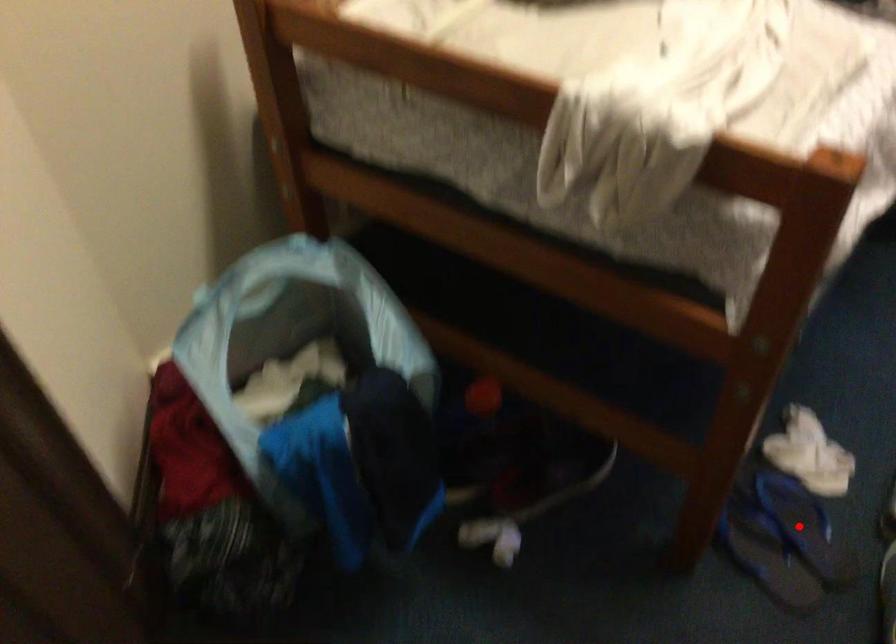
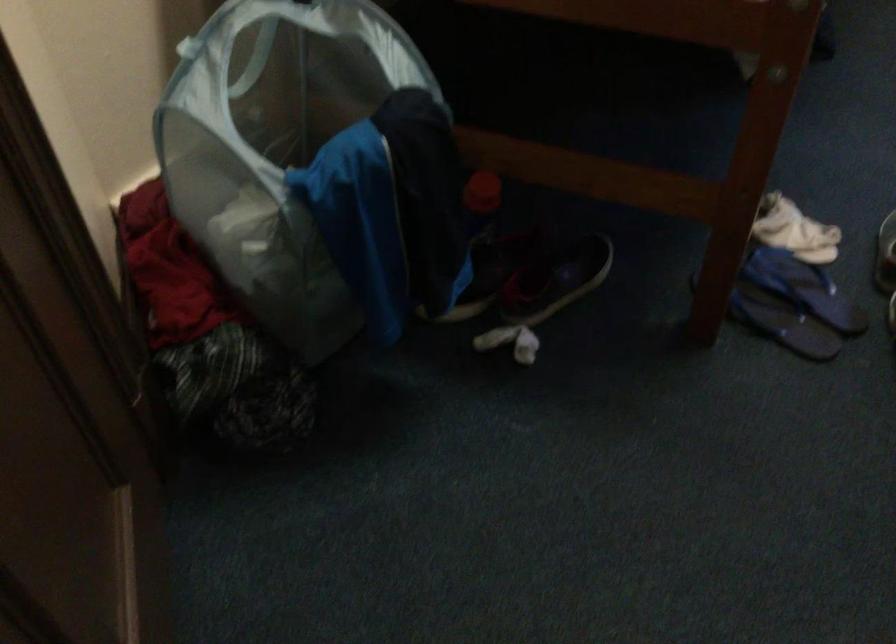
In the second image, find the point that corresponds to the highlighted location in the first image.

(804, 288)